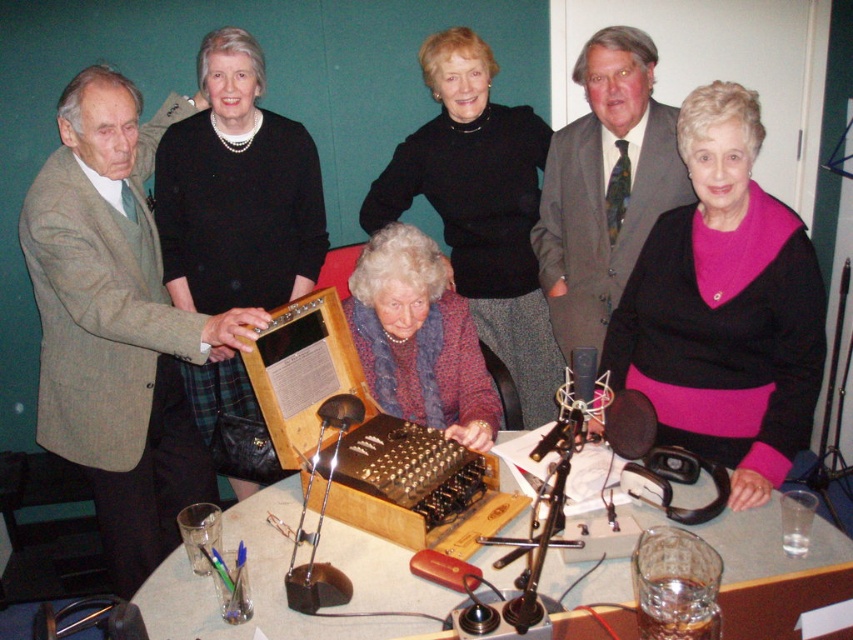
You are organizing a clothing display and need to stack the black wool sweater at upper center and the floral sweater at center. Which sweater should be placed on top to match the image?

The black wool sweater at upper center should be placed on top of the floral sweater at center because in the image, the black wool sweater at upper center is positioned over the floral sweater at center.

You are organizing a meeting in a room with a plain green wall. You need to place a wooden table at center and a gray suit at center. Based on the scene description, which object should be placed first to ensure proper fitting in the room?

The wooden table at center should be placed first since it has a smaller size compared to the gray suit at center, ensuring there is enough space for both objects in the room.

You are standing in the room and want to place a new decorative item exactly at the center of the room. The black matte sweater at center is currently located at coordinates 0.480, 0.850. Is the sweater already positioned at the room center?

The black matte sweater at center is located at coordinates (724, 307). Since the room center would typically be at coordinates (426, 320), the sweater is slightly offset to the right and down from the true center.